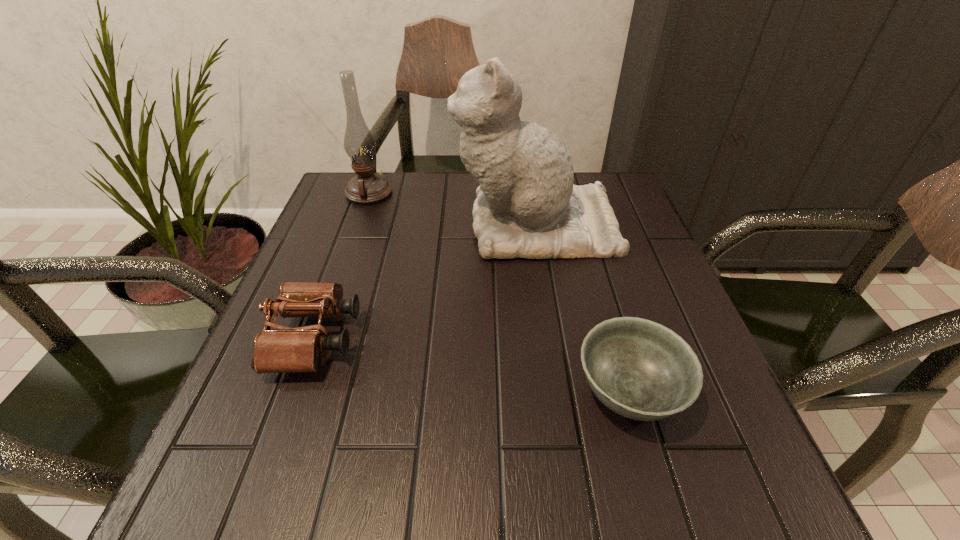
Identify the location of vacant space at the left edge. The height and width of the screenshot is (540, 960). (316, 419).

Locate an element on the screen. The height and width of the screenshot is (540, 960). blank space at the right edge is located at coordinates (649, 253).

In the image, there is a desktop. Identify the location of blank space at the far left corner. This screenshot has width=960, height=540. (344, 188).

The image size is (960, 540). What are the coordinates of `free point at the far right corner` in the screenshot? It's located at (627, 187).

At what (x,y) coordinates should I click in order to perform the action: click on free space between the third shortest object and the cat. Please return your answer as a coordinate pair (x, y). The image size is (960, 540). Looking at the image, I should click on (452, 210).

Where is `free spot between the tallest object and the binoculars`? free spot between the tallest object and the binoculars is located at coordinates (425, 282).

The width and height of the screenshot is (960, 540). Find the location of `free spot between the oil lamp and the bowl`. free spot between the oil lamp and the bowl is located at coordinates (499, 293).

The height and width of the screenshot is (540, 960). Find the location of `free spot between the bowl and the second tallest object`. free spot between the bowl and the second tallest object is located at coordinates (499, 293).

Where is `free space between the oil lamp and the tallest object`? The height and width of the screenshot is (540, 960). free space between the oil lamp and the tallest object is located at coordinates (452, 210).

Find the location of a particular element. This screenshot has width=960, height=540. free area in between the binoculars and the second tallest object is located at coordinates (342, 266).